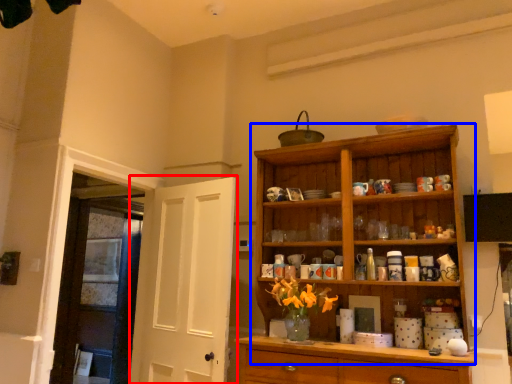
Question: Which of the following is the farthest to the observer, door (highlighted by a red box) or cupboard (highlighted by a blue box)?

Choices:
 (A) door
 (B) cupboard

Answer: (A)